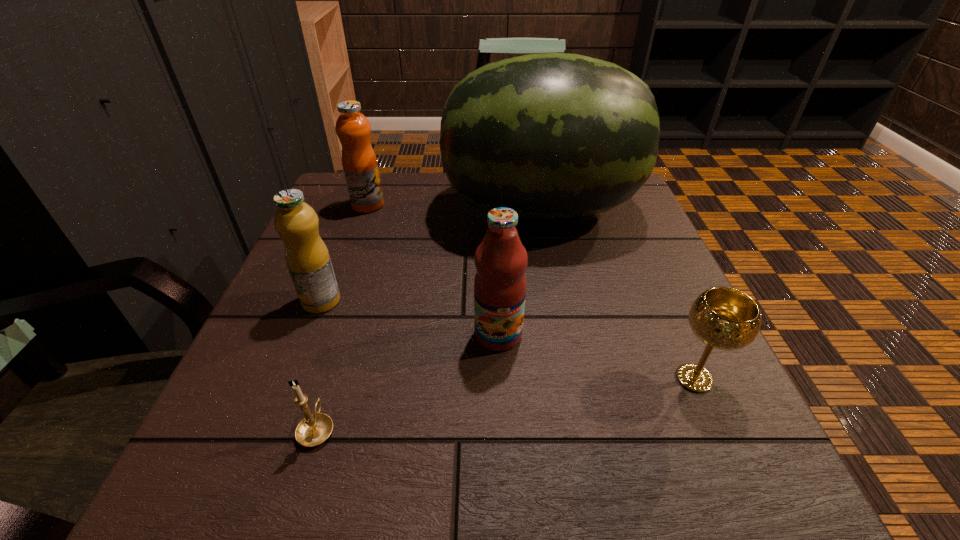
Locate an element on the screen. This screenshot has width=960, height=540. the tallest object is located at coordinates (551, 135).

This screenshot has width=960, height=540. What are the coordinates of `the farthest fruit juice` in the screenshot? It's located at (353, 129).

Find the location of a particular element. the nearest fruit juice is located at coordinates (501, 259).

Locate an element on the screen. the fourth farthest object is located at coordinates (501, 259).

The image size is (960, 540). In order to click on the fourth nearest object in this screenshot , I will do `click(307, 258)`.

This screenshot has height=540, width=960. In order to click on the fifth farthest object in this screenshot , I will do `click(723, 318)`.

The width and height of the screenshot is (960, 540). Identify the location of the second shortest object. (723, 318).

Find the location of `the shortest object`. the shortest object is located at coordinates (314, 429).

In order to click on the nearest object in this screenshot , I will do `click(314, 429)`.

At what (x,y) coordinates should I click in order to perform the action: click on free spot located on the left of the watermelon. Please return your answer as a coordinate pair (x, y). This screenshot has height=540, width=960. Looking at the image, I should click on (387, 208).